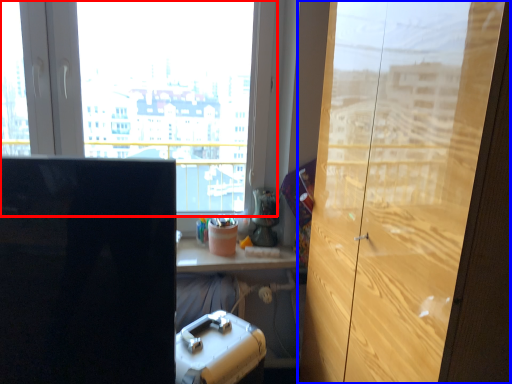
Question: Which object appears farthest to the camera in this image, window (highlighted by a red box) or cupboard (highlighted by a blue box)?

Choices:
 (A) window
 (B) cupboard

Answer: (A)